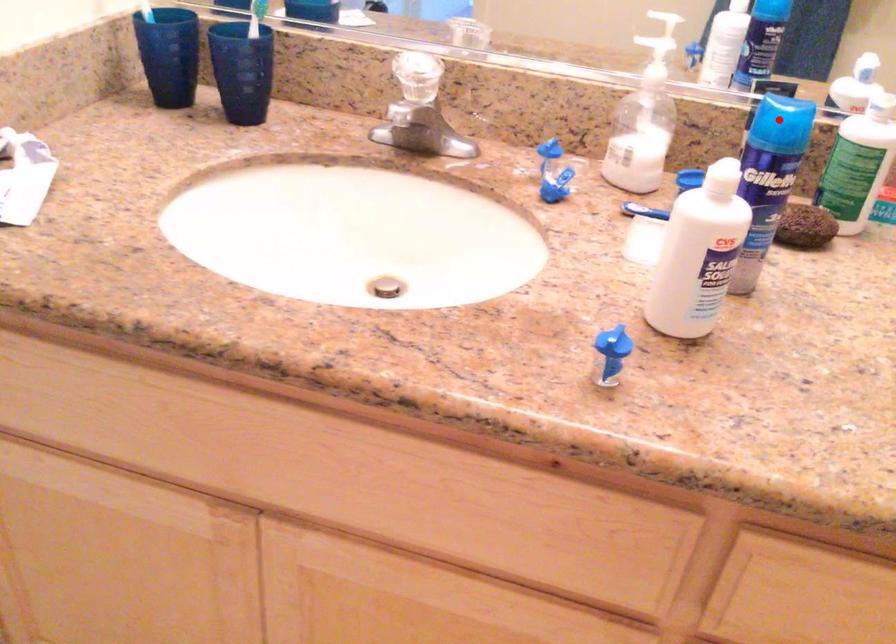
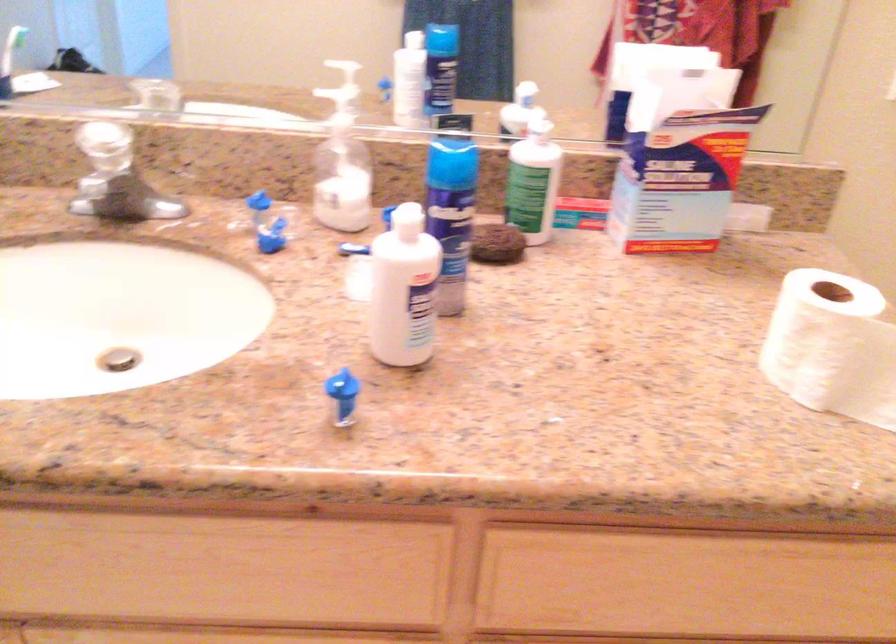
Question: I am providing you with two images of the same scene from different viewpoints. In image1, a red point is highlighted. Considering the same 3D point in image2, which of the following is correct?

Choices:
 (A) It is closer
 (B) It is farther

Answer: (B)